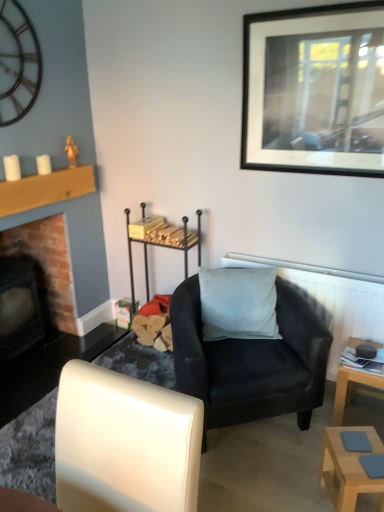
Locate an element on the screen. empty space that is ontop of light wood table at lower right, the 2th table when ordered from back to front is located at coordinates (362, 449).